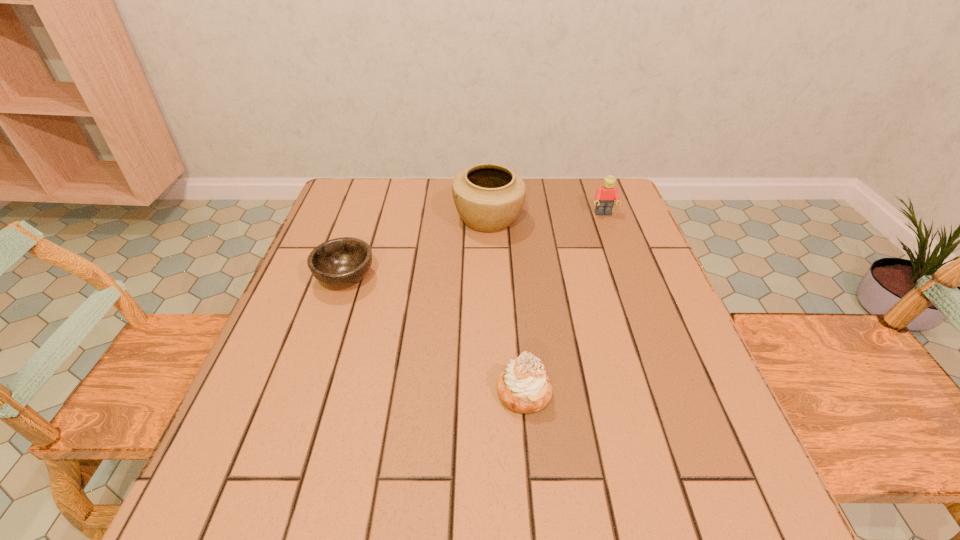
Where is `vacant region located 0.280m on the back of the bowl`? vacant region located 0.280m on the back of the bowl is located at coordinates (372, 198).

The width and height of the screenshot is (960, 540). I want to click on pottery that is at the far edge, so click(x=488, y=197).

Locate an element on the screen. The image size is (960, 540). Lego situated at the far edge is located at coordinates (605, 196).

At what (x,y) coordinates should I click in order to perform the action: click on object located in the left edge section of the desktop. Please return your answer as a coordinate pair (x, y). The height and width of the screenshot is (540, 960). Looking at the image, I should click on (340, 262).

Find the location of `object at the right edge`. object at the right edge is located at coordinates (605, 196).

Where is `object at the far right corner`? object at the far right corner is located at coordinates (605, 196).

The image size is (960, 540). In order to click on free space at the far edge in this screenshot , I will do `click(405, 218)`.

This screenshot has height=540, width=960. In order to click on vacant region at the near edge of the desktop in this screenshot , I will do `click(364, 497)`.

Identify the location of free space at the left edge of the desktop. (243, 427).

Where is `free location at the right edge of the desktop`? Image resolution: width=960 pixels, height=540 pixels. free location at the right edge of the desktop is located at coordinates (645, 416).